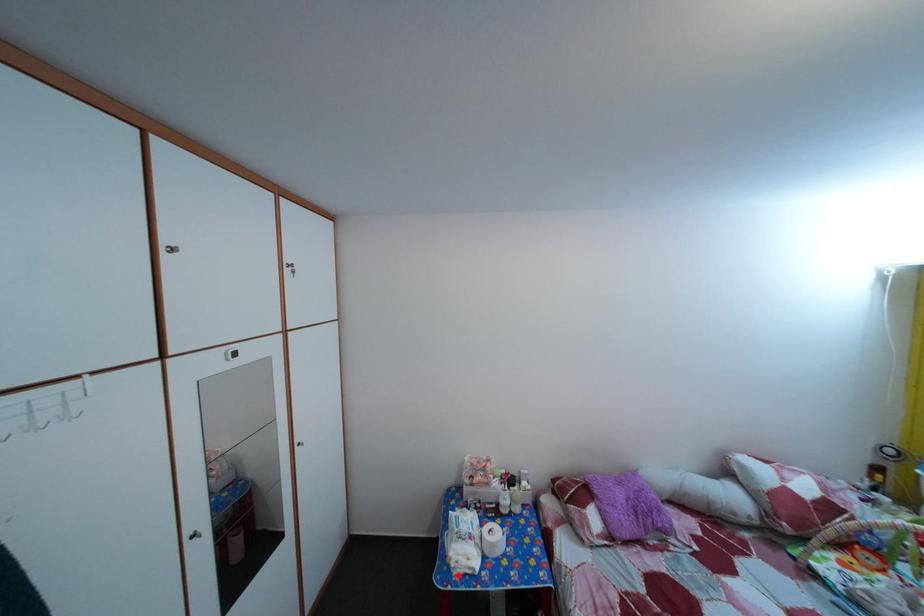
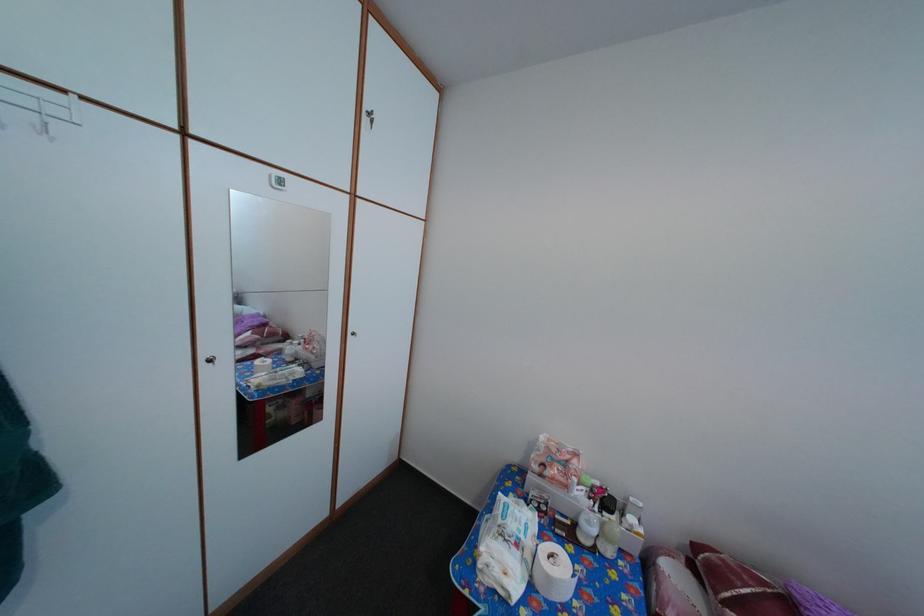
The point at the highlighted location is marked in the first image. Where is the corresponding point in the second image?

(484, 572)